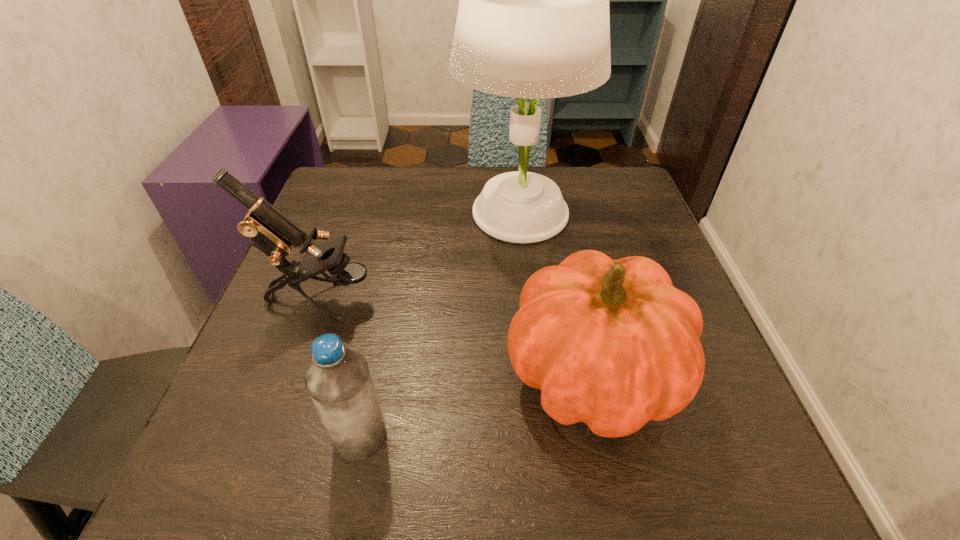
You are a GUI agent. You are given a task and a screenshot of the screen. Output one action in this format:
    pyautogui.click(x=<x>, y=<y>)
    Task: Click on the vacant space at the near edge of the desktop
    
    Given the screenshot: What is the action you would take?
    pyautogui.click(x=574, y=470)

Locate an element on the screen. This screenshot has height=540, width=960. free spot at the left edge of the desktop is located at coordinates (276, 352).

In the image, there is a desktop. Identify the location of vacant space at the right edge. (610, 219).

In the image, there is a desktop. In order to click on vacant space at the far left corner in this screenshot , I will do `click(320, 204)`.

Where is `free spot at the near left corner of the desktop`? Image resolution: width=960 pixels, height=540 pixels. free spot at the near left corner of the desktop is located at coordinates (242, 444).

The width and height of the screenshot is (960, 540). In order to click on empty space that is in between the tallest object and the water bottle in this screenshot , I will do `click(440, 325)`.

At what (x,y) coordinates should I click in order to perform the action: click on blank region between the shortest object and the pumpkin. Please return your answer as a coordinate pair (x, y). This screenshot has width=960, height=540. Looking at the image, I should click on (476, 406).

Find the location of a particular element. vacant point located between the microscope and the farthest object is located at coordinates tap(420, 256).

The width and height of the screenshot is (960, 540). I want to click on vacant area that lies between the microscope and the farthest object, so click(x=420, y=256).

Locate an element on the screen. The image size is (960, 540). free space between the microscope and the lamp is located at coordinates (420, 256).